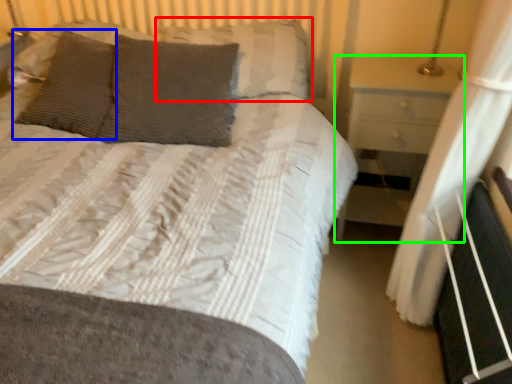
Question: Based on their relative distances, which object is farther from pillow (highlighted by a red box)? Choose from pillow (highlighted by a blue box) and nightstand (highlighted by a green box).

Choices:
 (A) pillow
 (B) nightstand

Answer: (A)